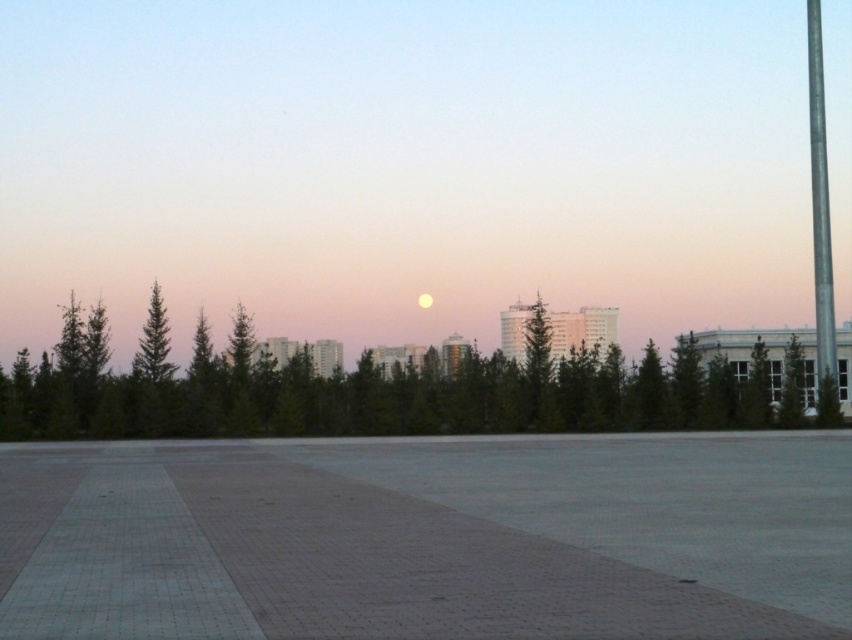
Which is below, metallic pole at right or green matte tree at center?

green matte tree at center is lower down.

Can you confirm if metallic pole at right is wider than green matte tree at center?

Yes, metallic pole at right is wider than green matte tree at center.

Is point (832, 292) positioned in front of point (781, 385)?

No, (832, 292) is behind (781, 385).

Where is `metallic pole at right`? The image size is (852, 640). metallic pole at right is located at coordinates (820, 224).

Can you confirm if green leafy tree at center is bigger than metallic pole at right?

Actually, green leafy tree at center might be smaller than metallic pole at right.

Is point (297, 432) farther from camera compared to point (815, 120)?

No, it is not.

You are a GUI agent. You are given a task and a screenshot of the screen. Output one action in this format:
    pyautogui.click(x=<x>, y=<y>)
    Task: Click on the green leafy tree at center
    The height and width of the screenshot is (640, 852).
    Given the screenshot: What is the action you would take?
    pyautogui.click(x=363, y=388)

This screenshot has width=852, height=640. I want to click on green leafy tree at center, so click(x=363, y=388).

Is green leafy tree at center shorter than green matte tree at center?

In fact, green leafy tree at center may be taller than green matte tree at center.

Which is in front, point (678, 342) or point (792, 362)?

Point (792, 362) is in front.

Is point (675, 353) more distant than point (789, 339)?

No, (675, 353) is closer to viewer.

This screenshot has width=852, height=640. Find the location of `green leafy tree at center`. green leafy tree at center is located at coordinates (363, 388).